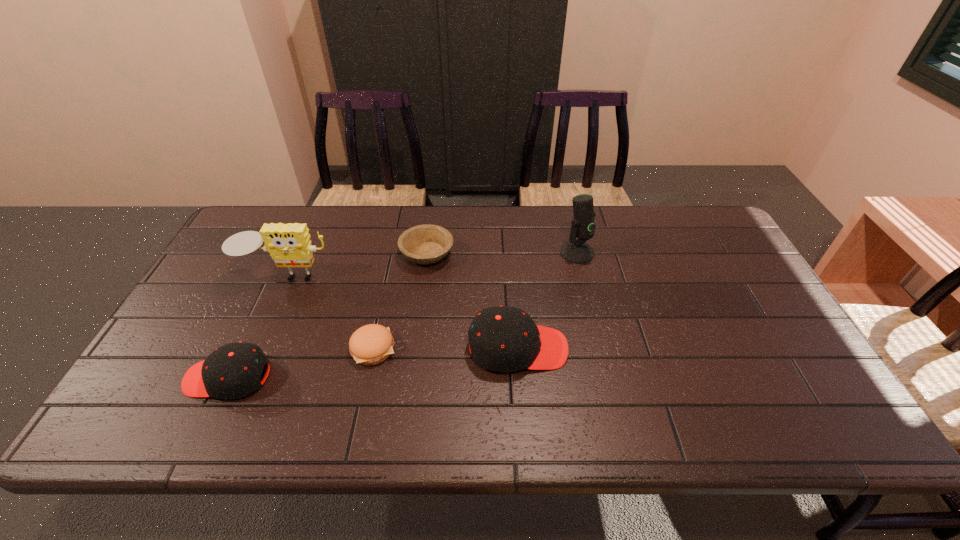
Please point a vacant point for placing a cap on the right. Please provide its 2D coordinates. Your answer should be formatted as a tuple, i.e. [(x, y)], where the tuple contains the x and y coordinates of a point satisfying the conditions above.

[(777, 322)]